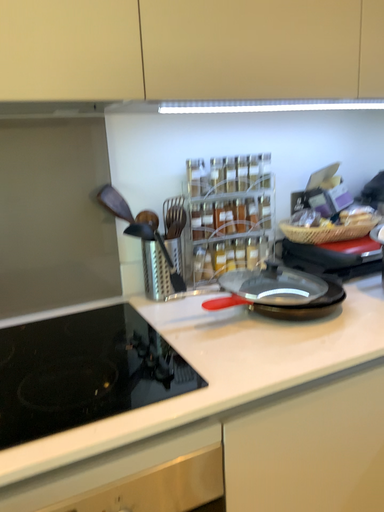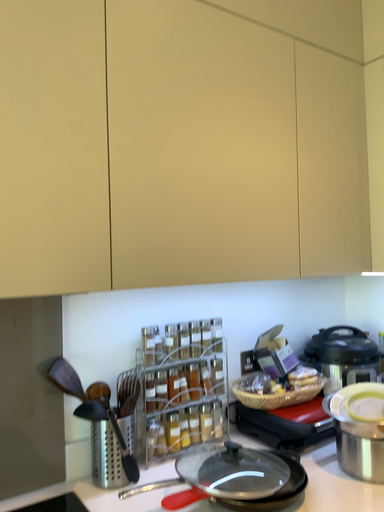
Question: How did the camera likely rotate when shooting the video?

Choices:
 (A) rotated right
 (B) rotated left

Answer: (A)